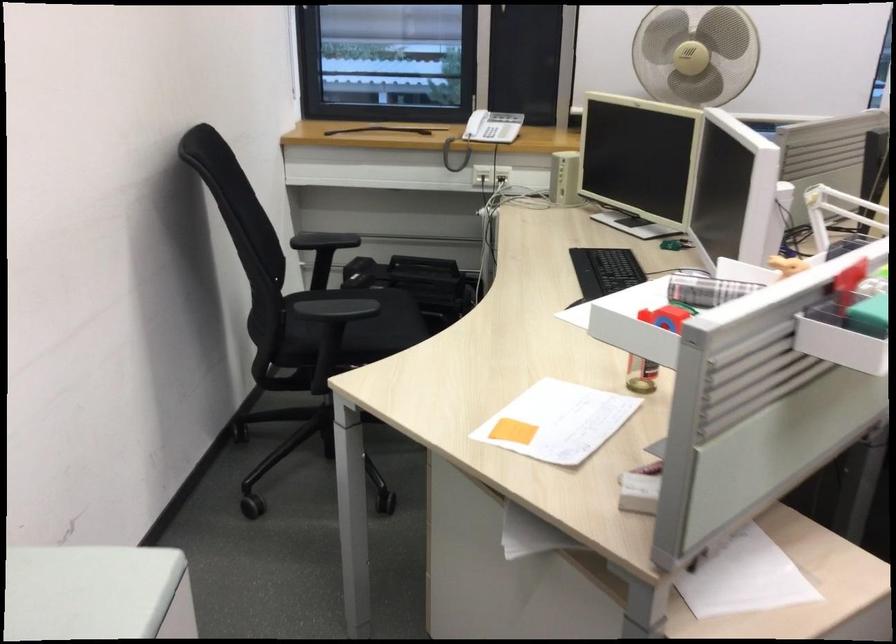
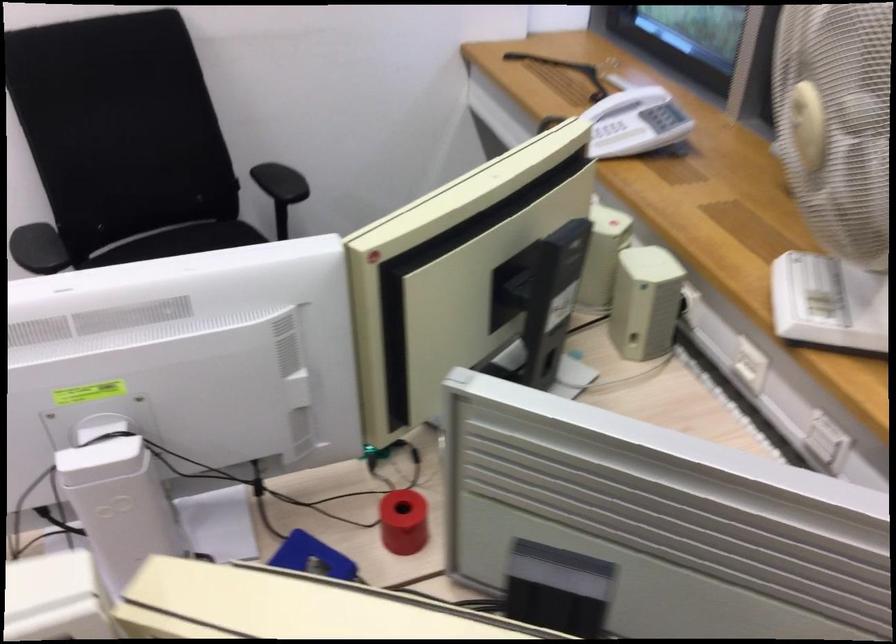
In the second image, find the point that corresponds to [478,122] in the first image.

(612, 131)